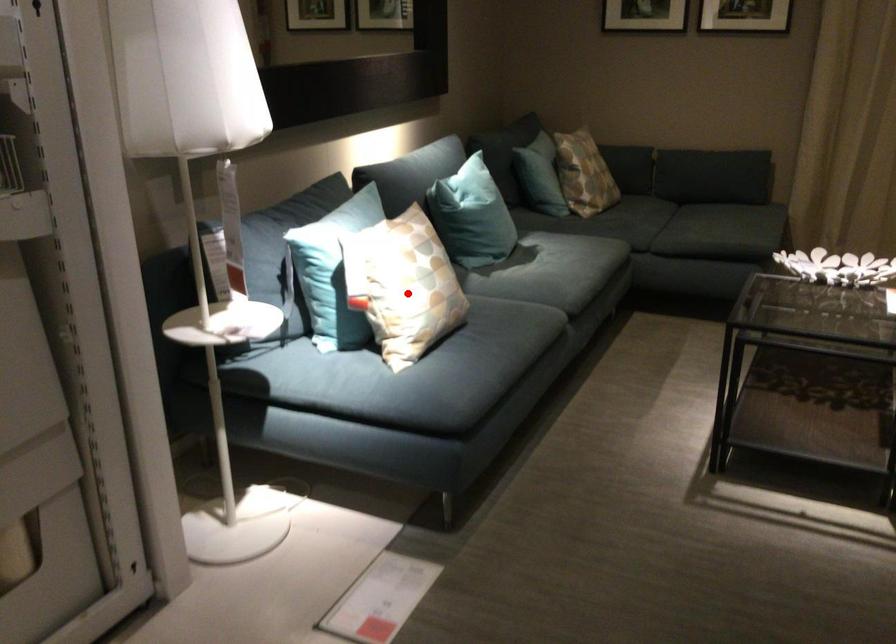
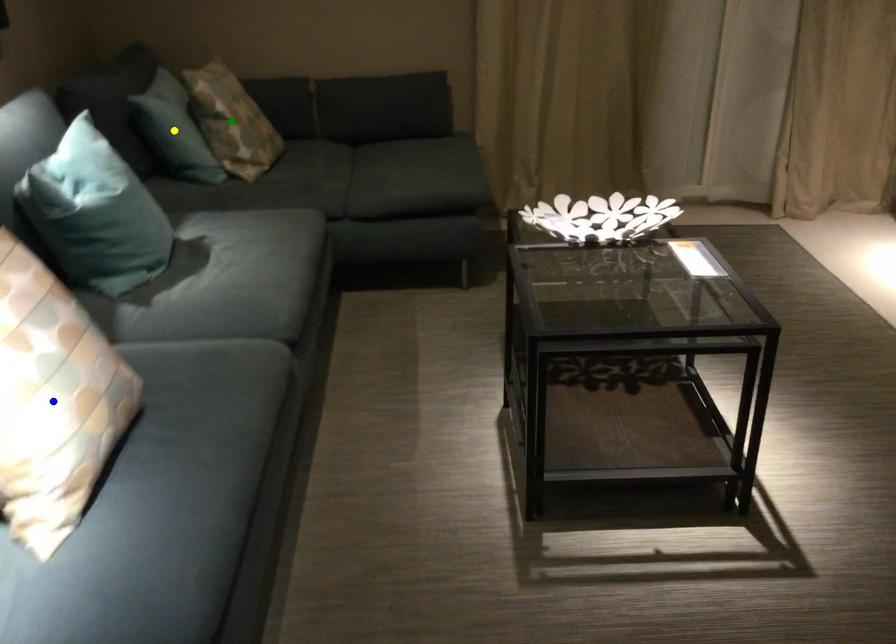
Question: I am providing you with two images of the same scene from different viewpoints. A red point is marked on the first image. You are given multiple points on the second image. Which point in image 2 represents the same 3d spot as the red point in image 1?

Choices:
 (A) blue point
 (B) green point
 (C) yellow point

Answer: (A)